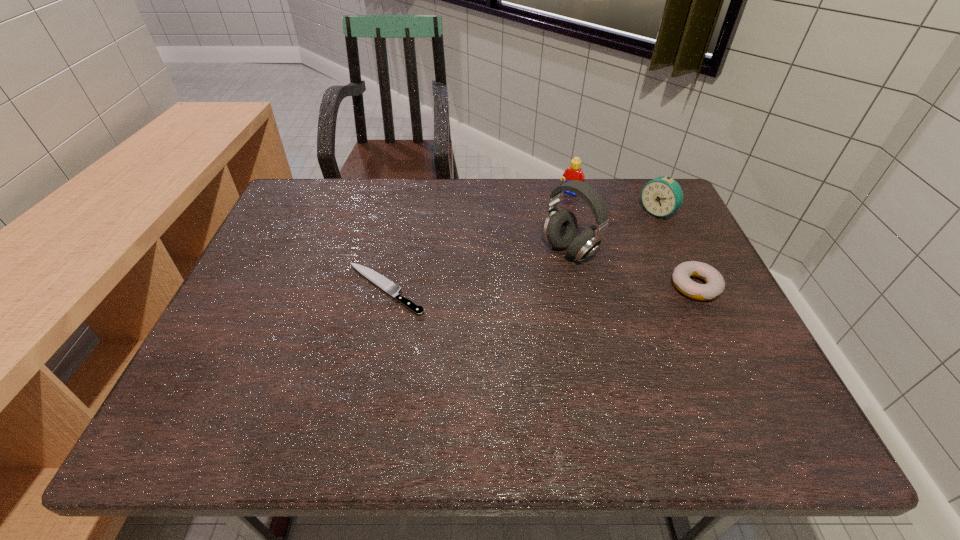
Locate an element on the screen. Image resolution: width=960 pixels, height=540 pixels. the shortest object is located at coordinates (388, 286).

This screenshot has width=960, height=540. I want to click on steak knife, so click(x=388, y=286).

Identify the location of doughnut. The width and height of the screenshot is (960, 540). (715, 284).

You are a GUI agent. You are given a task and a screenshot of the screen. Output one action in this format:
    pyautogui.click(x=<x>, y=<y>)
    Task: Click on the fourth nearest object
    
    Given the screenshot: What is the action you would take?
    pyautogui.click(x=662, y=196)

Find the location of a particular element. The width and height of the screenshot is (960, 540). Lego is located at coordinates (574, 172).

I want to click on headset, so click(560, 228).

Locate an element on the screen. The width and height of the screenshot is (960, 540). free space located on the left of the leftmost object is located at coordinates (310, 289).

Where is `blank area located on the front of the second shortest object`? Image resolution: width=960 pixels, height=540 pixels. blank area located on the front of the second shortest object is located at coordinates (715, 328).

At what (x,y) coordinates should I click in order to perform the action: click on free point located on the front-facing side of the alarm clock. Please return your answer as a coordinate pair (x, y). Looking at the image, I should click on (560, 282).

Locate an element on the screen. The height and width of the screenshot is (540, 960). blank space located on the front-facing side of the alarm clock is located at coordinates (636, 227).